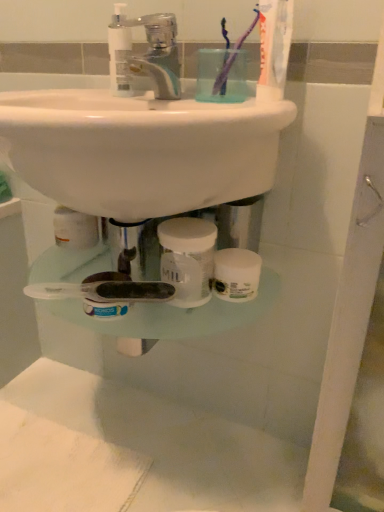
Locate an element on the screen. This screenshot has height=512, width=384. white opaque jar at center, positioned as the second mouthwash in top-to-bottom order is located at coordinates (188, 259).

What do you see at coordinates (222, 77) in the screenshot? I see `purple plastic toothbrush at upper center, the second toothbrush viewed from the right` at bounding box center [222, 77].

What do you see at coordinates (233, 56) in the screenshot? This screenshot has height=512, width=384. I see `purple translucent toothbrush at upper center, the 1th toothbrush when ordered from right to left` at bounding box center [233, 56].

Identify the location of clear plastic faucet at upper center. (158, 54).

Locate an element on the screen. white opaque jar at center, positioned as the second mouthwash in top-to-bottom order is located at coordinates (188, 259).

From a real-world perspective, relative to clear plastic faucet at upper center, is purple translucent toothbrush at upper center, the 1th toothbrush when ordered from right to left, vertically above or below?

In terms of real-world spatial position, purple translucent toothbrush at upper center, the 1th toothbrush when ordered from right to left, is above clear plastic faucet at upper center.

Where is `tap below the purple translucent toothbrush at upper center, the 1th toothbrush when ordered from right to left (from the image's perspective)`? This screenshot has height=512, width=384. tap below the purple translucent toothbrush at upper center, the 1th toothbrush when ordered from right to left (from the image's perspective) is located at coordinates (158, 54).

Does point (239, 46) come behind point (137, 22)?

No.

Considering the relative positions of purple translucent toothbrush at upper center, the 1th toothbrush when ordered from right to left, and clear plastic faucet at upper center in the image provided, is purple translucent toothbrush at upper center, the 1th toothbrush when ordered from right to left, to the left of clear plastic faucet at upper center from the viewer's perspective?

Incorrect, purple translucent toothbrush at upper center, the 1th toothbrush when ordered from right to left, is not on the left side of clear plastic faucet at upper center.

Between white opaque jar at center, the 1th mouthwash in the bottom-to-top sequence, and purple translucent toothbrush at upper center, the 2th toothbrush when ordered from left to right, which one has smaller size?

purple translucent toothbrush at upper center, the 2th toothbrush when ordered from left to right.

Is white opaque jar at center, the 1th mouthwash in the bottom-to-top sequence, in front of purple translucent toothbrush at upper center, the 1th toothbrush when ordered from right to left?

That is True.

Is white opaque jar at center, the 1th mouthwash positioned from the right, at the left side of purple translucent toothbrush at upper center, the 1th toothbrush when ordered from right to left?

Yes, white opaque jar at center, the 1th mouthwash positioned from the right, is to the left of purple translucent toothbrush at upper center, the 1th toothbrush when ordered from right to left.

You are a GUI agent. You are given a task and a screenshot of the screen. Output one action in this format:
    pyautogui.click(x=<x>, y=<y>)
    Task: Click on the mouthwash above the white opaque jar at center, which is the second mouthwash in left-to-right order (from the image's perspective)
    The height and width of the screenshot is (512, 384).
    Given the screenshot: What is the action you would take?
    pyautogui.click(x=119, y=52)

Would you say transparent plastic mouthwash at upper center, the 2th mouthwash when ordered from bottom to top, is a long distance from white opaque jar at center, positioned as the second mouthwash in top-to-bottom order?

Actually, transparent plastic mouthwash at upper center, the 2th mouthwash when ordered from bottom to top, and white opaque jar at center, positioned as the second mouthwash in top-to-bottom order, are a little close together.

Who is taller, transparent plastic mouthwash at upper center, the 1th mouthwash viewed from the top, or white opaque jar at center, the 1th mouthwash positioned from the right?

transparent plastic mouthwash at upper center, the 1th mouthwash viewed from the top.

Consider the image. Which object is wider, transparent plastic mouthwash at upper center, the 2th mouthwash when ordered from bottom to top, or white opaque jar at center, positioned as the second mouthwash in top-to-bottom order?

white opaque jar at center, positioned as the second mouthwash in top-to-bottom order.

Which of these two, transparent plastic mouthwash at upper center, the 2th mouthwash when ordered from bottom to top, or purple translucent toothbrush at upper center, the 2th toothbrush when ordered from left to right, is bigger?

With larger size is purple translucent toothbrush at upper center, the 2th toothbrush when ordered from left to right.

Considering the sizes of objects transparent plastic mouthwash at upper center, the 2th mouthwash when ordered from bottom to top, and purple translucent toothbrush at upper center, the 1th toothbrush when ordered from right to left, in the image provided, who is wider, transparent plastic mouthwash at upper center, the 2th mouthwash when ordered from bottom to top, or purple translucent toothbrush at upper center, the 1th toothbrush when ordered from right to left,?

purple translucent toothbrush at upper center, the 1th toothbrush when ordered from right to left, is wider.

From a real-world perspective, is transparent plastic mouthwash at upper center, the 2th mouthwash when ordered from bottom to top, positioned under purple translucent toothbrush at upper center, the 2th toothbrush when ordered from left to right, based on gravity?

Indeed, from a real-world perspective, transparent plastic mouthwash at upper center, the 2th mouthwash when ordered from bottom to top, is positioned beneath purple translucent toothbrush at upper center, the 2th toothbrush when ordered from left to right.

Is transparent plastic mouthwash at upper center, the 2th mouthwash when ordered from bottom to top, positioned behind purple translucent toothbrush at upper center, the 1th toothbrush when ordered from right to left?

Yes.

Between purple translucent toothbrush at upper center, the 2th toothbrush when ordered from left to right, and purple plastic toothbrush at upper center, the second toothbrush viewed from the right, which one has smaller size?

purple plastic toothbrush at upper center, the second toothbrush viewed from the right, is smaller.

Considering the points (224, 82) and (225, 53), which point is behind, point (224, 82) or point (225, 53)?

Positioned behind is point (225, 53).

Is purple translucent toothbrush at upper center, the 2th toothbrush when ordered from left to right, positioned beyond the bounds of purple plastic toothbrush at upper center, placed as the 1th toothbrush when sorted from left to right?

Indeed, purple translucent toothbrush at upper center, the 2th toothbrush when ordered from left to right, is completely outside purple plastic toothbrush at upper center, placed as the 1th toothbrush when sorted from left to right.

In the image, is purple translucent toothbrush at upper center, the 1th toothbrush when ordered from right to left, on the left side or the right side of purple plastic toothbrush at upper center, the second toothbrush viewed from the right?

Based on their positions, purple translucent toothbrush at upper center, the 1th toothbrush when ordered from right to left, is located to the right of purple plastic toothbrush at upper center, the second toothbrush viewed from the right.

At what (x,y) coordinates should I click in order to perform the action: click on the 2nd toothbrush behind the clear plastic faucet at upper center. Please return your answer as a coordinate pair (x, y). Looking at the image, I should click on [222, 77].

Which object is positioned more to the right, purple plastic toothbrush at upper center, placed as the 1th toothbrush when sorted from left to right, or clear plastic faucet at upper center?

purple plastic toothbrush at upper center, placed as the 1th toothbrush when sorted from left to right, is more to the right.

Is purple plastic toothbrush at upper center, the second toothbrush viewed from the right, smaller than clear plastic faucet at upper center?

Yes, purple plastic toothbrush at upper center, the second toothbrush viewed from the right, is smaller than clear plastic faucet at upper center.

Which is less distant, (229, 65) or (150, 47)?

The point (229, 65) is closer.

Looking at this image, which object is wider, clear plastic faucet at upper center or purple plastic toothbrush at upper center, the second toothbrush viewed from the right?

clear plastic faucet at upper center is wider.

Is clear plastic faucet at upper center surrounding purple plastic toothbrush at upper center, placed as the 1th toothbrush when sorted from left to right?

That's incorrect, purple plastic toothbrush at upper center, placed as the 1th toothbrush when sorted from left to right, is not inside clear plastic faucet at upper center.

Between clear plastic faucet at upper center and purple plastic toothbrush at upper center, the second toothbrush viewed from the right, which one appears on the left side from the viewer's perspective?

clear plastic faucet at upper center.

Is point (175, 40) less distant than point (225, 34)?

No.

Locate an element on the screen. tap in front of the purple translucent toothbrush at upper center, the 2th toothbrush when ordered from left to right is located at coordinates [158, 54].

From a real-world perspective, starting from the white opaque jar at center, which is the second mouthwash in left-to-right order, which toothbrush is the 2nd one vertically above it? Please provide its 2D coordinates.

[(233, 56)]

From the image, which object appears to be nearer to transparent plastic mouthwash at upper center, the 1th mouthwash viewed from the top, purple translucent toothbrush at upper center, the 1th toothbrush when ordered from right to left, or clear plastic faucet at upper center?

clear plastic faucet at upper center is closer to transparent plastic mouthwash at upper center, the 1th mouthwash viewed from the top.

From the image, which object appears to be farther from white opaque jar at center, the 1th mouthwash positioned from the right, purple plastic toothbrush at upper center, the second toothbrush viewed from the right, or purple translucent toothbrush at upper center, the 2th toothbrush when ordered from left to right?

Among the two, purple translucent toothbrush at upper center, the 2th toothbrush when ordered from left to right, is located further to white opaque jar at center, the 1th mouthwash positioned from the right.

Looking at this image, estimate the real-world distances between objects in this image. Which object is closer to clear plastic faucet at upper center, purple plastic toothbrush at upper center, the second toothbrush viewed from the right, or white opaque jar at center, which is the second mouthwash in left-to-right order?

Among the two, purple plastic toothbrush at upper center, the second toothbrush viewed from the right, is located nearer to clear plastic faucet at upper center.

Looking at the image, which one is located further to transparent plastic mouthwash at upper center, the 2th mouthwash when ordered from bottom to top, purple translucent toothbrush at upper center, the 1th toothbrush when ordered from right to left, or purple plastic toothbrush at upper center, the second toothbrush viewed from the right?

purple translucent toothbrush at upper center, the 1th toothbrush when ordered from right to left.

Looking at the image, which one is located closer to white opaque jar at center, the 1th mouthwash in the bottom-to-top sequence, transparent plastic mouthwash at upper center, the 2th mouthwash when ordered from bottom to top, or purple plastic toothbrush at upper center, placed as the 1th toothbrush when sorted from left to right?

purple plastic toothbrush at upper center, placed as the 1th toothbrush when sorted from left to right.

Considering their positions, is clear plastic faucet at upper center positioned further to white opaque jar at center, which is the second mouthwash in left-to-right order, than purple plastic toothbrush at upper center, the second toothbrush viewed from the right?

clear plastic faucet at upper center lies further to white opaque jar at center, which is the second mouthwash in left-to-right order, than the other object.

Considering their positions, is white opaque jar at center, which is the second mouthwash in left-to-right order, positioned further to clear plastic faucet at upper center than purple translucent toothbrush at upper center, the 2th toothbrush when ordered from left to right?

white opaque jar at center, which is the second mouthwash in left-to-right order, lies further to clear plastic faucet at upper center than the other object.

From the picture: From the image, which object appears to be nearer to white opaque jar at center, positioned as the second mouthwash in top-to-bottom order, clear plastic faucet at upper center or transparent plastic mouthwash at upper center, which is the 1th mouthwash in left-to-right order?

clear plastic faucet at upper center is closer to white opaque jar at center, positioned as the second mouthwash in top-to-bottom order.

Where is `tap located between transparent plastic mouthwash at upper center, the 2th mouthwash from the right, and purple plastic toothbrush at upper center, the second toothbrush viewed from the right, in the left-right direction`? The height and width of the screenshot is (512, 384). tap located between transparent plastic mouthwash at upper center, the 2th mouthwash from the right, and purple plastic toothbrush at upper center, the second toothbrush viewed from the right, in the left-right direction is located at coordinates (158, 54).

In order to click on tap between purple translucent toothbrush at upper center, the 2th toothbrush when ordered from left to right, and white opaque jar at center, the 1th mouthwash in the bottom-to-top sequence, in the vertical direction in this screenshot , I will do `click(158, 54)`.

Find the location of a particular element. This screenshot has height=512, width=384. tap between transparent plastic mouthwash at upper center, the 2th mouthwash from the right, and white opaque jar at center, the 1th mouthwash in the bottom-to-top sequence, in the up-down direction is located at coordinates (158, 54).

Where is `toothbrush between transparent plastic mouthwash at upper center, the 2th mouthwash when ordered from bottom to top, and purple translucent toothbrush at upper center, the 1th toothbrush when ordered from right to left`? toothbrush between transparent plastic mouthwash at upper center, the 2th mouthwash when ordered from bottom to top, and purple translucent toothbrush at upper center, the 1th toothbrush when ordered from right to left is located at coordinates (222, 77).